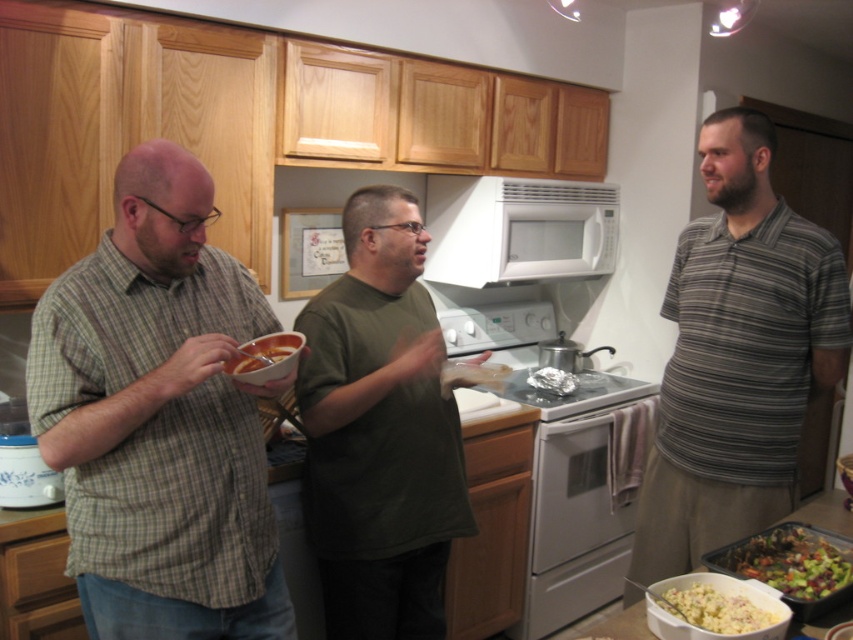
You are a chef standing in the kitchen and want to place a new recipe book on the counter between the green plaid shirt at left and the shiny silver pot at center. Considering their heights, which object should you place the book closer to to ensure it is visible over?

The green plaid shirt at left is much taller than the shiny silver pot at center, so you should place the book closer to the shiny silver pot at center to ensure it is visible over.

You are a chef who needs to determine which object is wider between the green plaid shirt at left and the shiny silver pot at center. Which one is wider?

The green plaid shirt at left is wider than the shiny silver pot at center according to the description.